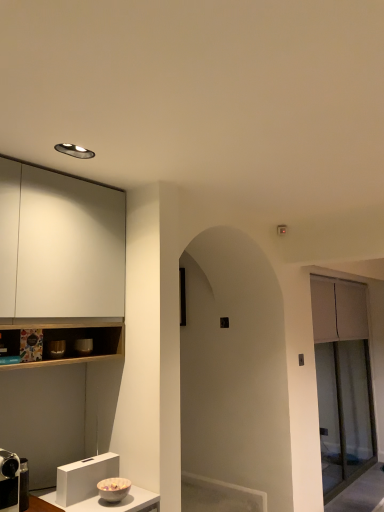
Question: Is matte silver bowl at left, which appears as the first appliance when viewed from the top, oriented towards clear glass screen door at right?

Choices:
 (A) no
 (B) yes

Answer: (A)

Question: From the image's perspective, is matte silver bowl at left, the 2th appliance from the front, on top of clear glass screen door at right?

Choices:
 (A) yes
 (B) no

Answer: (A)

Question: Does matte silver bowl at left, which appears as the first appliance when viewed from the top, have a larger size compared to clear glass screen door at right?

Choices:
 (A) yes
 (B) no

Answer: (B)

Question: Is matte silver bowl at left, which appears as the first appliance when viewed from the top, oriented away from clear glass screen door at right?

Choices:
 (A) yes
 (B) no

Answer: (B)

Question: Does matte silver bowl at left, the 2th appliance from the front, appear on the left side of clear glass screen door at right?

Choices:
 (A) no
 (B) yes

Answer: (B)

Question: From a real-world perspective, is matte silver bowl at left, acting as the 3th appliance starting from the bottom, located beneath clear glass screen door at right?

Choices:
 (A) no
 (B) yes

Answer: (A)

Question: Is metallic silver camera at lower left, the first appliance viewed from the left, positioned beyond the bounds of matte ceramic bowl at left, placed as the first appliance when sorted from back to front?

Choices:
 (A) no
 (B) yes

Answer: (B)

Question: Is metallic silver camera at lower left, the third appliance from the top, facing towards matte ceramic bowl at left, placed as the first appliance when sorted from back to front?

Choices:
 (A) no
 (B) yes

Answer: (A)

Question: From a real-world perspective, is metallic silver camera at lower left, the 3th appliance from the right, physically above matte ceramic bowl at left, arranged as the second appliance when viewed from the top?

Choices:
 (A) no
 (B) yes

Answer: (A)

Question: Is metallic silver camera at lower left, the third appliance from the top, wider than matte ceramic bowl at left, arranged as the 1th appliance when viewed from the right?

Choices:
 (A) no
 (B) yes

Answer: (B)

Question: Does metallic silver camera at lower left, the 3th appliance from the back, have a lesser width compared to matte ceramic bowl at left, placed as the first appliance when sorted from back to front?

Choices:
 (A) no
 (B) yes

Answer: (A)

Question: Is metallic silver camera at lower left, the 3th appliance from the right, at the left side of matte ceramic bowl at left, arranged as the second appliance when viewed from the top?

Choices:
 (A) yes
 (B) no

Answer: (A)

Question: Is clear glass screen door at right directly adjacent to matte ceramic bowl at left, arranged as the second appliance when viewed from the top?

Choices:
 (A) yes
 (B) no

Answer: (B)